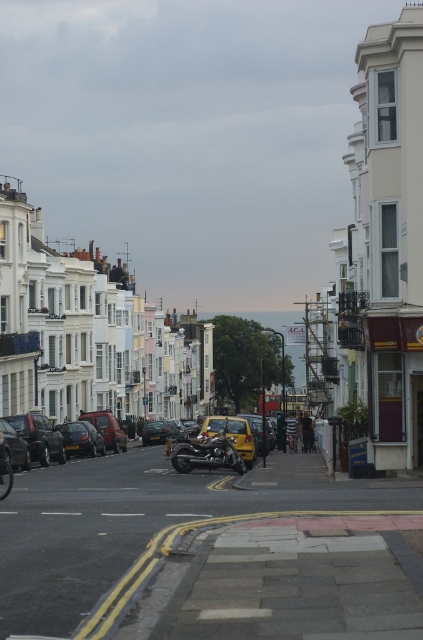
Question: Is matte black car at center-left further to the viewer compared to shiny black car at left?

Choices:
 (A) yes
 (B) no

Answer: (A)

Question: Which point is closer to the camera?

Choices:
 (A) shiny black car at left
 (B) shiny black car at center-left

Answer: (A)

Question: Is matte black car at center-left bigger than shiny black car at center-left?

Choices:
 (A) yes
 (B) no

Answer: (A)

Question: Which object appears farthest from the camera in this image?

Choices:
 (A) shiny chrome motorcycle at center
 (B) shiny black car at center-left
 (C) matte black car at center-left
 (D) shiny black car at left

Answer: (B)

Question: Among these points, which one is nearest to the camera?

Choices:
 (A) (65, 426)
 (B) (18, 449)

Answer: (B)

Question: Is matte black car at center-left positioned behind shiny black car at center-left?

Choices:
 (A) yes
 (B) no

Answer: (B)